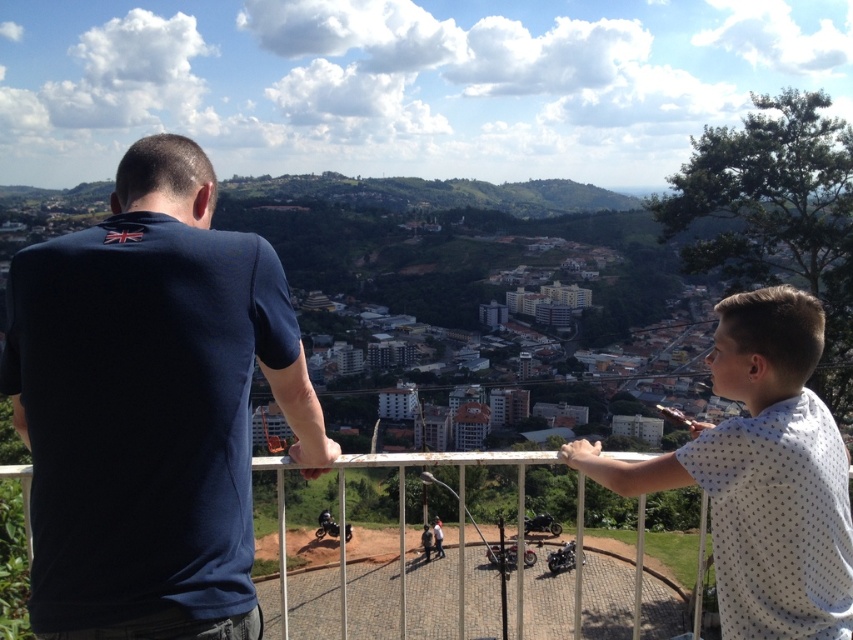
Can you confirm if white dotted shirt at upper right is thinner than white metal fence at center?

Yes, white dotted shirt at upper right is thinner than white metal fence at center.

Is point (689, 444) positioned after point (456, 564)?

No, (689, 444) is closer to viewer.

What do you see at coordinates (762, 474) in the screenshot? I see `white dotted shirt at upper right` at bounding box center [762, 474].

Find the location of `white dotted shirt at upper right`. white dotted shirt at upper right is located at coordinates (762, 474).

Measure the distance from dark blue t-shirt at upper left to white dotted shirt at upper right.

A distance of 175.39 feet exists between dark blue t-shirt at upper left and white dotted shirt at upper right.

Does point (21, 301) lie behind point (793, 352)?

No, it is not.

Where is `dark blue t-shirt at upper left`? dark blue t-shirt at upper left is located at coordinates (149, 406).

Consider the image. Does dark blue t-shirt at upper left have a smaller size compared to shiny black motorcycle at center?

No, dark blue t-shirt at upper left is not smaller than shiny black motorcycle at center.

Who is shorter, dark blue t-shirt at upper left or shiny black motorcycle at center?

Standing shorter between the two is shiny black motorcycle at center.

Who is more distant from viewer, (195, 317) or (349, 531)?

Positioned behind is point (349, 531).

This screenshot has width=853, height=640. Identify the location of dark blue t-shirt at upper left. (149, 406).